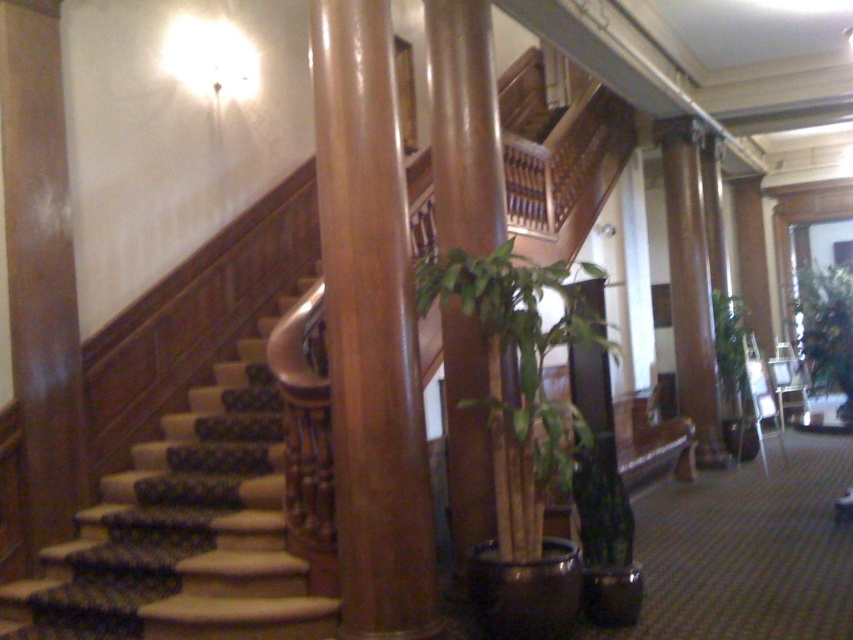
Question: Which point is closer to the camera?

Choices:
 (A) green leafy plant at right
 (B) green leafy plant at center
 (C) polished wood pillar at center

Answer: (B)

Question: Among these objects, which one is nearest to the camera?

Choices:
 (A) green leafy plant at right
 (B) glossy wood pillar at center

Answer: (B)

Question: Does glossy wood pillar at center have a greater width compared to green leafy plant at right?

Choices:
 (A) no
 (B) yes

Answer: (A)

Question: Can you confirm if carpeted wood stairs at left is wider than green leafy plant at center?

Choices:
 (A) no
 (B) yes

Answer: (B)

Question: Is green leafy plant at center smaller than green leafy plant at center-right?

Choices:
 (A) no
 (B) yes

Answer: (A)

Question: Which object appears farthest from the camera in this image?

Choices:
 (A) polished wood pillar at center
 (B) green leafy plant at right
 (C) carpeted wood stairs at left

Answer: (B)